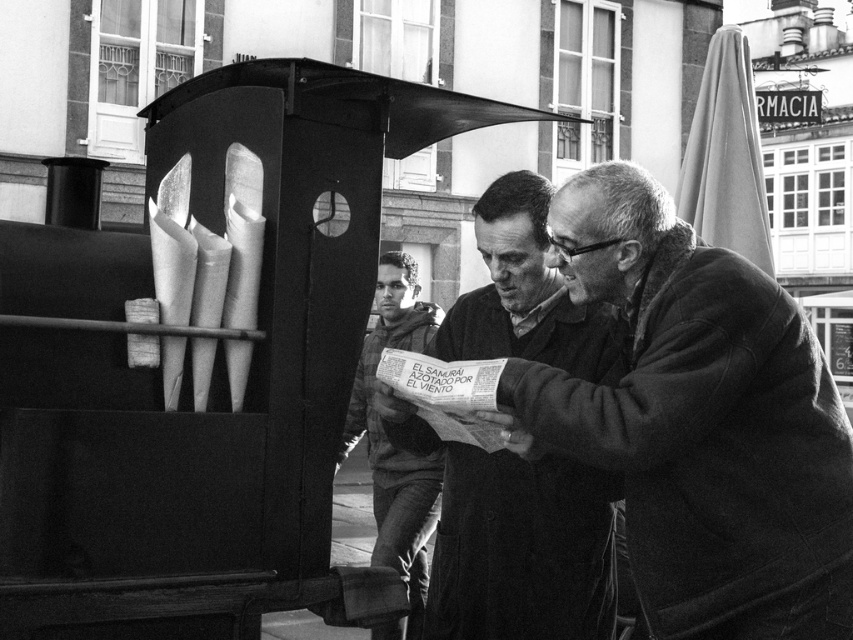
You are observing the two people in the center of the image. Which clothing item is positioned lower on their bodies? The smooth leather jacket at center or the dark gray hoodie at center?

The smooth leather jacket at center is located below the dark gray hoodie at center, so the smooth leather jacket at center is positioned lower on their bodies.

Based on the scene described, which clothing item at center is shorter in height between the smooth leather jacket at center and the dark gray hoodie at center?

The smooth leather jacket at center is shorter in height than the dark gray hoodie at center.